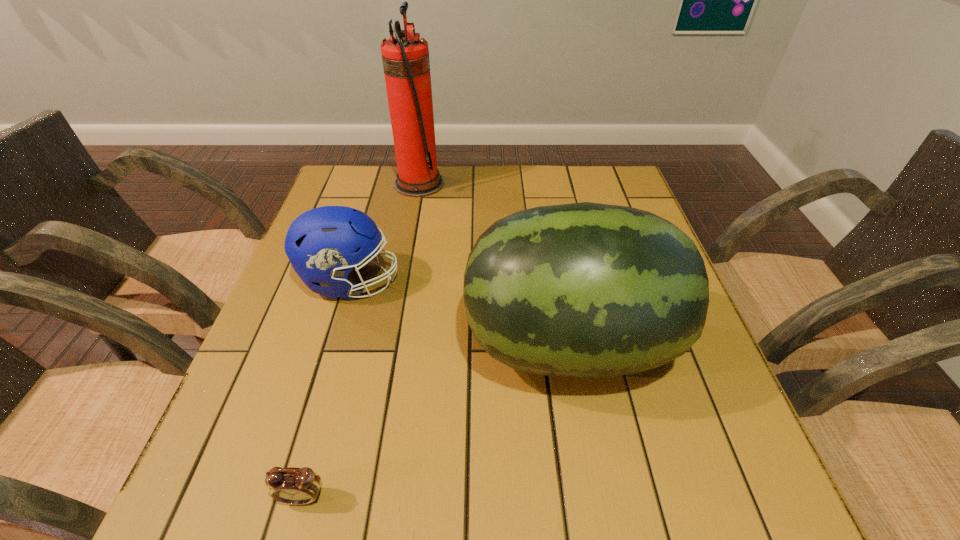
Find the location of `fire extinguisher`. fire extinguisher is located at coordinates (406, 64).

At what (x,y) coordinates should I click in order to perform the action: click on the tallest object. Please return your answer as a coordinate pair (x, y). Looking at the image, I should click on (406, 64).

Identify the location of the rightmost object. This screenshot has height=540, width=960. (585, 290).

Where is `watermelon`? The width and height of the screenshot is (960, 540). watermelon is located at coordinates (585, 290).

Locate an element on the screen. The width and height of the screenshot is (960, 540). football helmet is located at coordinates (324, 244).

In order to click on the nearest object in this screenshot , I will do `click(296, 486)`.

What are the coordinates of `alarm clock` in the screenshot? It's located at (296, 486).

Where is `free region located 0.170m at the discharge end of the farthest object`? free region located 0.170m at the discharge end of the farthest object is located at coordinates pyautogui.click(x=501, y=184).

In order to click on free space located on the back of the watermelon in this screenshot , I will do `click(549, 236)`.

At what (x,y) coordinates should I click in order to perform the action: click on vacant region located 0.340m on the front-facing side of the third tallest object. Please return your answer as a coordinate pair (x, y). The width and height of the screenshot is (960, 540). Looking at the image, I should click on (547, 281).